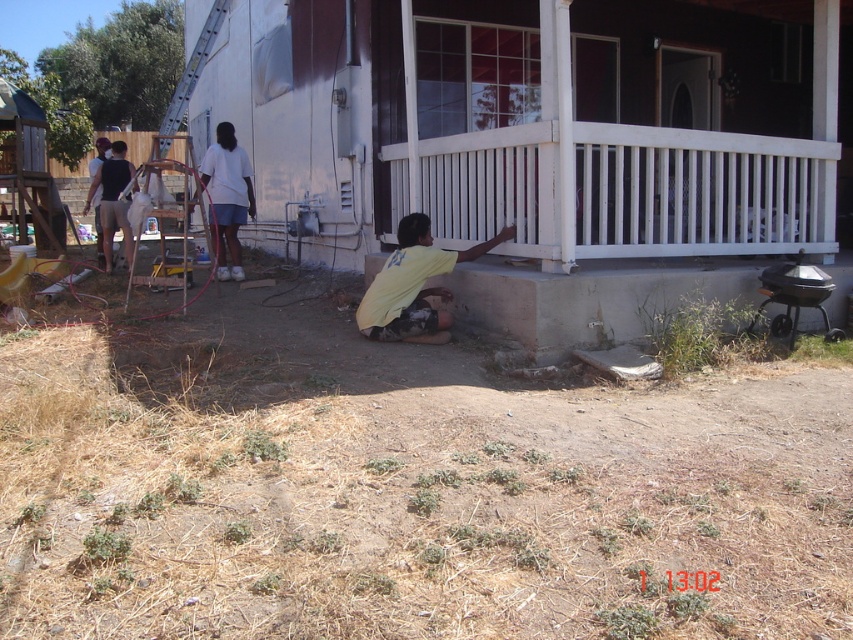
Question: Among these objects, which one is farthest from the camera?

Choices:
 (A) white painted wood porch at lower right
 (B) yellow matte shirt at center

Answer: (B)

Question: Does white painted wood porch at lower right appear under yellow matte shirt at center?

Choices:
 (A) yes
 (B) no

Answer: (B)

Question: Is white painted wood porch at lower right to the left of white cotton shirt at upper left from the viewer's perspective?

Choices:
 (A) no
 (B) yes

Answer: (A)

Question: Can you confirm if yellow matte shirt at center is positioned to the left of white cotton shirt at upper left?

Choices:
 (A) no
 (B) yes

Answer: (A)

Question: Which point is closer to the camera taking this photo?

Choices:
 (A) (404, 288)
 (B) (666, 138)
 (C) (238, 188)

Answer: (A)

Question: Among these points, which one is nearest to the camera?

Choices:
 (A) (209, 196)
 (B) (364, 332)
 (C) (619, 157)

Answer: (C)